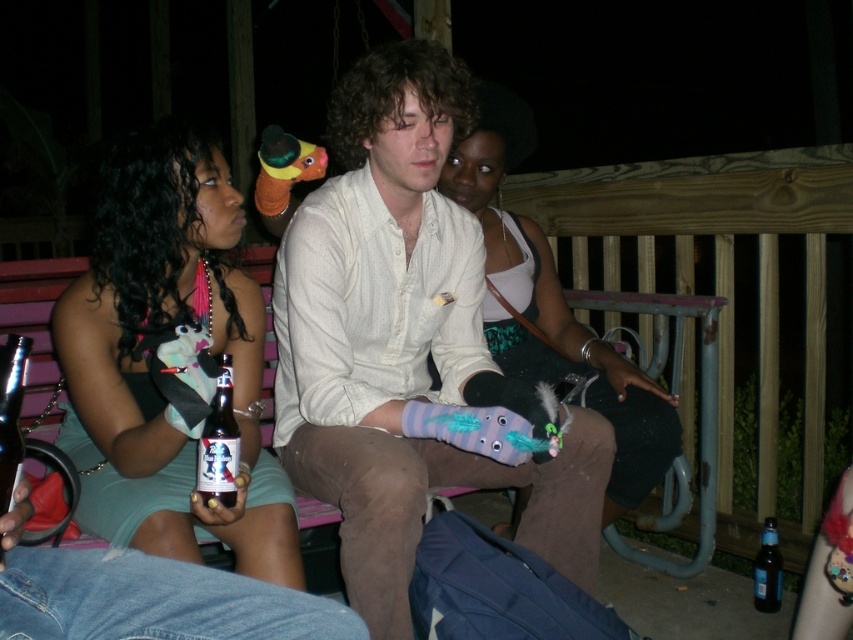
Based on the photo, can you confirm if matte black dress at center is shorter than dark blue glass bottle at lower right?

No, matte black dress at center is not shorter than dark blue glass bottle at lower right.

The width and height of the screenshot is (853, 640). Describe the element at coordinates (144, 362) in the screenshot. I see `matte black dress at center` at that location.

Is point (106, 189) positioned behind point (775, 608)?

No, (106, 189) is closer to viewer.

I want to click on matte black dress at center, so (x=144, y=362).

Between brown glass bottle at lower left and dark blue glass bottle at lower right, which one has more height?

brown glass bottle at lower left is taller.

Looking at this image, is brown glass bottle at lower left to the right of dark blue glass bottle at lower right from the viewer's perspective?

Incorrect, brown glass bottle at lower left is not on the right side of dark blue glass bottle at lower right.

Is point (225, 442) behind point (778, 573)?

No, it is in front of (778, 573).

The image size is (853, 640). Find the location of `brown glass bottle at lower left`. brown glass bottle at lower left is located at coordinates (219, 442).

Can you confirm if matte black dress at center is bigger than brown glass bottle at lower left?

Correct, matte black dress at center is larger in size than brown glass bottle at lower left.

In the scene shown: Is matte black dress at center below brown glass bottle at lower left?

Actually, matte black dress at center is above brown glass bottle at lower left.

Which is behind, point (149, 237) or point (207, 486)?

Point (149, 237)

Locate an element on the screen. The height and width of the screenshot is (640, 853). matte black dress at center is located at coordinates point(144,362).